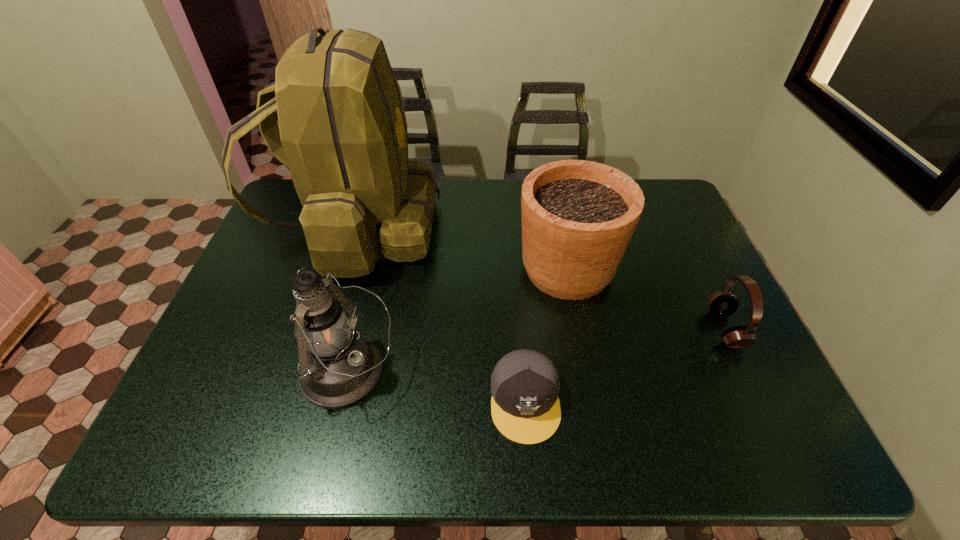
Where is `vacant space located 0.300m on the ear pads of the fourth tallest object`? The width and height of the screenshot is (960, 540). vacant space located 0.300m on the ear pads of the fourth tallest object is located at coordinates (592, 329).

The image size is (960, 540). I want to click on vacant area situated on the ear pads of the fourth tallest object, so click(x=568, y=329).

At what (x,y) coordinates should I click in order to perform the action: click on object that is positioned at the far edge. Please return your answer as a coordinate pair (x, y). Looking at the image, I should click on (342, 134).

You are a GUI agent. You are given a task and a screenshot of the screen. Output one action in this format:
    pyautogui.click(x=<x>, y=<y>)
    Task: Click on the object that is positioned at the near edge
    
    Given the screenshot: What is the action you would take?
    pyautogui.click(x=525, y=408)

This screenshot has height=540, width=960. Find the location of `object positioned at the left edge`. object positioned at the left edge is located at coordinates (342, 134).

Find the location of `object present at the right edge`. object present at the right edge is located at coordinates (721, 304).

You are a GUI agent. You are given a task and a screenshot of the screen. Output one action in this format:
    pyautogui.click(x=<x>, y=<y>)
    Task: Click on the object that is at the far left corner
    This screenshot has height=540, width=960.
    Given the screenshot: What is the action you would take?
    pyautogui.click(x=342, y=134)

Find the location of a particular element. free region at the far edge of the desktop is located at coordinates (487, 195).

You are a GUI agent. You are given a task and a screenshot of the screen. Output one action in this format:
    pyautogui.click(x=<x>, y=<y>)
    Task: Click on the vacant space at the near edge of the desktop
    The height and width of the screenshot is (540, 960).
    Given the screenshot: What is the action you would take?
    pyautogui.click(x=436, y=436)

This screenshot has width=960, height=540. I want to click on free region at the left edge of the desktop, so click(285, 310).